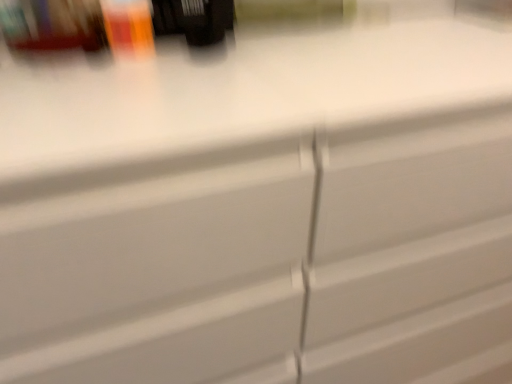
What do you see at coordinates (129, 28) in the screenshot?
I see `matte plastic beverage at upper left` at bounding box center [129, 28].

What is the approximate height of matte plastic beverage at upper left?

The height of matte plastic beverage at upper left is 3.57 inches.

Locate an element on the screen. The height and width of the screenshot is (384, 512). matte plastic beverage at upper left is located at coordinates (129, 28).

Find the location of a particular element. This screenshot has width=512, height=384. matte plastic beverage at upper left is located at coordinates (129, 28).